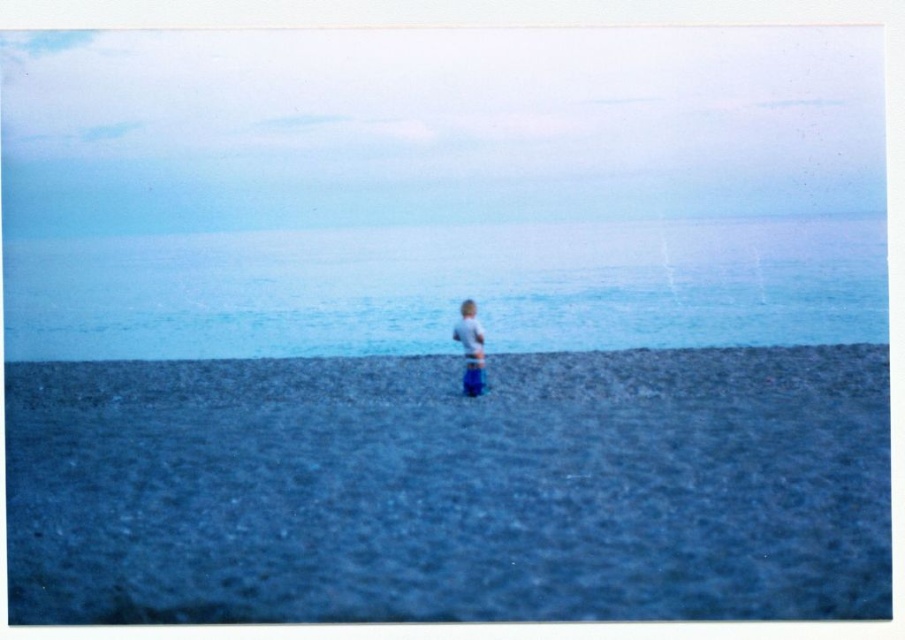
Is dark gray gravel at center bigger than white cotton shirt at center?

Yes, dark gray gravel at center is bigger than white cotton shirt at center.

Measure the distance from dark gray gravel at center to white cotton shirt at center.

dark gray gravel at center and white cotton shirt at center are 2.35 meters apart from each other.

Locate an element on the screen. This screenshot has height=640, width=905. dark gray gravel at center is located at coordinates (451, 486).

The height and width of the screenshot is (640, 905). I want to click on dark gray gravel at center, so click(x=451, y=486).

Can you confirm if dark gray gravel at center is positioned below blue water at center?

Correct, dark gray gravel at center is located below blue water at center.

You are a GUI agent. You are given a task and a screenshot of the screen. Output one action in this format:
    pyautogui.click(x=<x>, y=<y>)
    Task: Click on the dark gray gravel at center
    The height and width of the screenshot is (640, 905).
    Given the screenshot: What is the action you would take?
    pyautogui.click(x=451, y=486)

Is point (437, 577) positioned after point (244, 252)?

No, it is in front of (244, 252).

Identify the location of dark gray gravel at center. (451, 486).

Based on the photo, measure the distance between blue water at center and camera.

blue water at center is 16.32 meters away from camera.

Is blue water at center positioned behind white cotton shirt at center?

Yes.

Which is behind, point (856, 221) or point (465, 368)?

Point (856, 221)

Where is `blue water at center`? This screenshot has width=905, height=640. blue water at center is located at coordinates (446, 289).